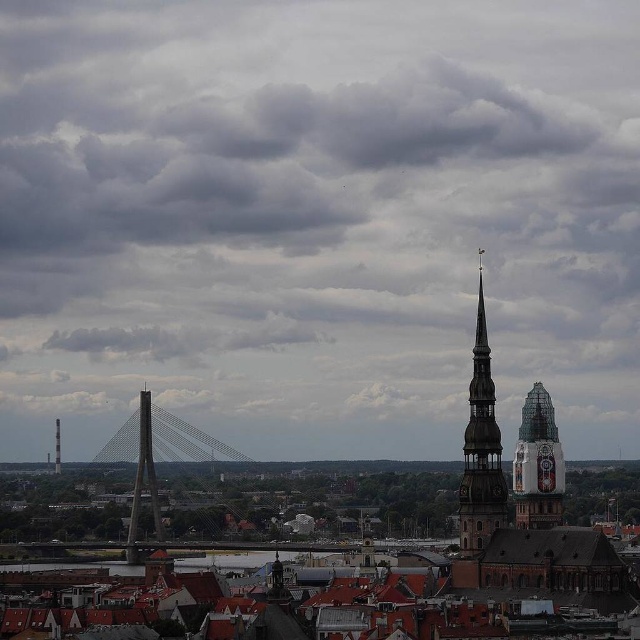
Is cloudy sky at upper center bigger than shiny glass bell tower at right?

Correct, cloudy sky at upper center is larger in size than shiny glass bell tower at right.

Can you confirm if cloudy sky at upper center is thinner than shiny glass bell tower at right?

No.

Describe the element at coordinates (317, 220) in the screenshot. The width and height of the screenshot is (640, 640). I see `cloudy sky at upper center` at that location.

Where is `cloudy sky at upper center`? The image size is (640, 640). cloudy sky at upper center is located at coordinates (317, 220).

Does cloudy sky at upper center lie in front of dark gray stone spire at center-right?

No.

Does cloudy sky at upper center have a lesser height compared to dark gray stone spire at center-right?

No, cloudy sky at upper center is not shorter than dark gray stone spire at center-right.

The image size is (640, 640). What do you see at coordinates (317, 220) in the screenshot?
I see `cloudy sky at upper center` at bounding box center [317, 220].

This screenshot has height=640, width=640. I want to click on cloudy sky at upper center, so click(x=317, y=220).

How distant is dark gray stone spire at center-right from metallic cable-stayed bridge at center-left?

A distance of 154.23 meters exists between dark gray stone spire at center-right and metallic cable-stayed bridge at center-left.

Can you confirm if dark gray stone spire at center-right is shorter than metallic cable-stayed bridge at center-left?

No, dark gray stone spire at center-right is not shorter than metallic cable-stayed bridge at center-left.

Which is in front, point (477, 305) or point (168, 426)?

Positioned in front is point (477, 305).

This screenshot has width=640, height=640. Identify the location of dark gray stone spire at center-right. (481, 449).